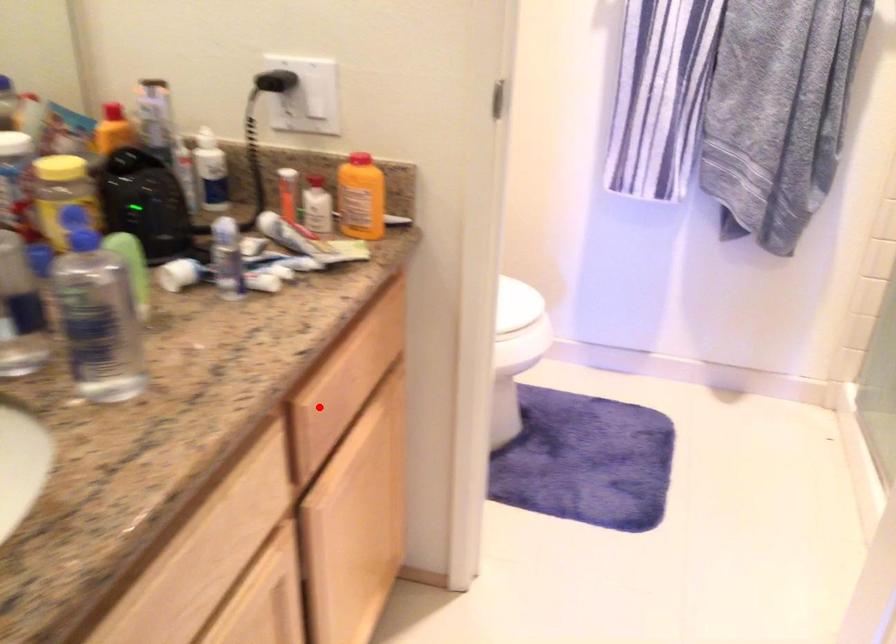
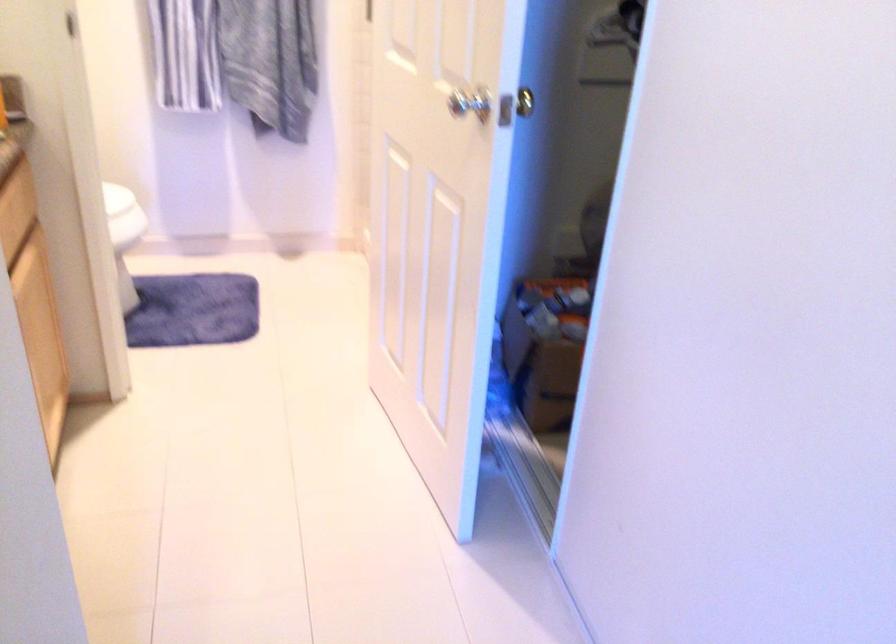
Question: I am providing you with two images of the same scene from different viewpoints. Given a red point in image1, look at the same physical point in image2. Is it:

Choices:
 (A) Closer to the viewpoint
 (B) Farther from the viewpoint

Answer: (B)